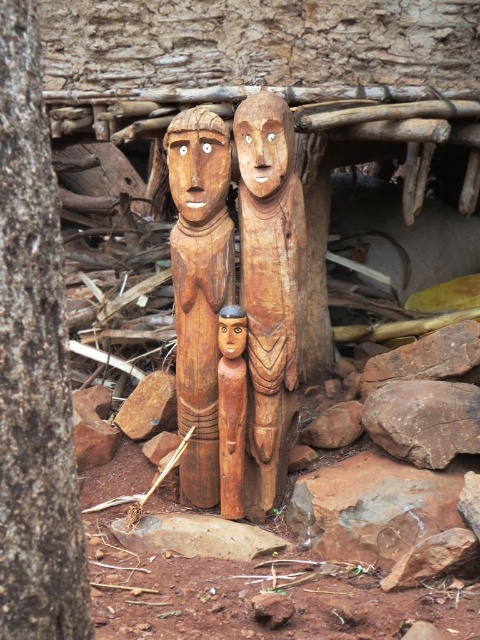
Question: Is smooth wood figurine at center positioned in front of brown rough stone at lower left?

Choices:
 (A) yes
 (B) no

Answer: (A)

Question: Among these points, which one is nearest to the camera?

Choices:
 (A) coord(155,422)
 (B) coord(274,308)
 (C) coord(230,308)

Answer: (C)

Question: Where is brown rough tree trunk at left located in relation to natural wood carving at center in the image?

Choices:
 (A) left
 (B) right

Answer: (A)

Question: Among these points, which one is nearest to the camera?

Choices:
 (A) (283, 292)
 (B) (226, 508)
 (C) (22, 312)
 (D) (430, 390)

Answer: (C)

Question: Can you confirm if wooden statue at center is positioned to the right of brown rough rock at center?

Choices:
 (A) no
 (B) yes

Answer: (A)

Question: Which object is the farthest from the brown rough stone at lower left?

Choices:
 (A) natural wood carving at center
 (B) brown rough rock at center
 (C) smooth wood figurine at center

Answer: (B)